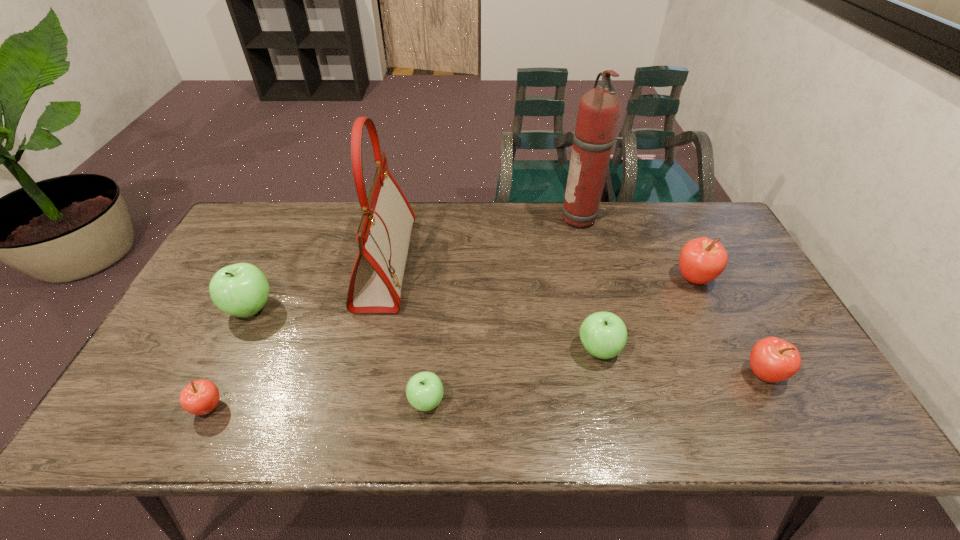
I want to click on object that stands as the sixth closest to the biggest pink apple, so click(x=241, y=290).

Select which object appears as the second closest to the second biggest pink apple. Please provide its 2D coordinates. Your answer should be formatted as a tuple, i.e. [(x, y)], where the tuple contains the x and y coordinates of a point satisfying the conditions above.

[(603, 334)]

Identify which apple is the sixth closest to the pink handbag. Please provide its 2D coordinates. Your answer should be formatted as a tuple, i.e. [(x, y)], where the tuple contains the x and y coordinates of a point satisfying the conditions above.

[(772, 359)]

Identify the location of apple that is the third closest one to the smallest green apple. (241, 290).

Image resolution: width=960 pixels, height=540 pixels. What are the coordinates of `pink apple that stands as the closest to the second green apple from right to left` in the screenshot? It's located at (200, 397).

Where is `pink apple that is the closest to the nearest pink apple`? Image resolution: width=960 pixels, height=540 pixels. pink apple that is the closest to the nearest pink apple is located at coordinates pyautogui.click(x=701, y=260).

At what (x,y) coordinates should I click in order to perform the action: click on green apple that is the nearest to the farthest green apple. Please return your answer as a coordinate pair (x, y). The height and width of the screenshot is (540, 960). Looking at the image, I should click on (424, 391).

Select which green apple is the second closest to the biggest pink apple. Please provide its 2D coordinates. Your answer should be formatted as a tuple, i.e. [(x, y)], where the tuple contains the x and y coordinates of a point satisfying the conditions above.

[(424, 391)]

This screenshot has height=540, width=960. What are the coordinates of `vacant space that satisfies the following two spatial constraints: 1. on the side of the red fire extinguisher with the label and nozzle; 2. on the right side of the second smallest pink apple` in the screenshot? It's located at (624, 374).

The width and height of the screenshot is (960, 540). I want to click on free space that satisfies the following two spatial constraints: 1. on the front side of the second nearest green apple; 2. on the left side of the third object from left to right, so click(368, 349).